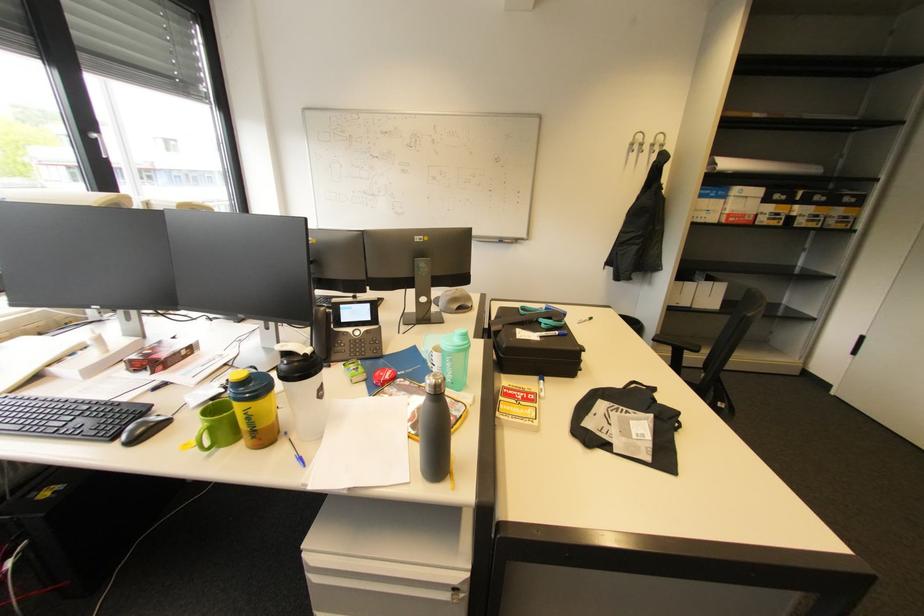
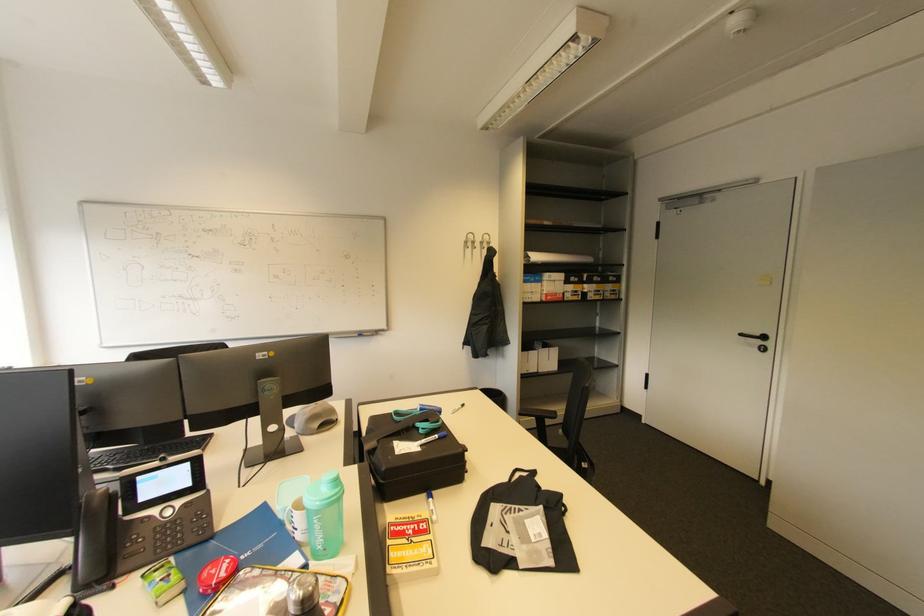
The point at (701, 274) is marked in the first image. Where is the corresponding point in the second image?

(541, 342)